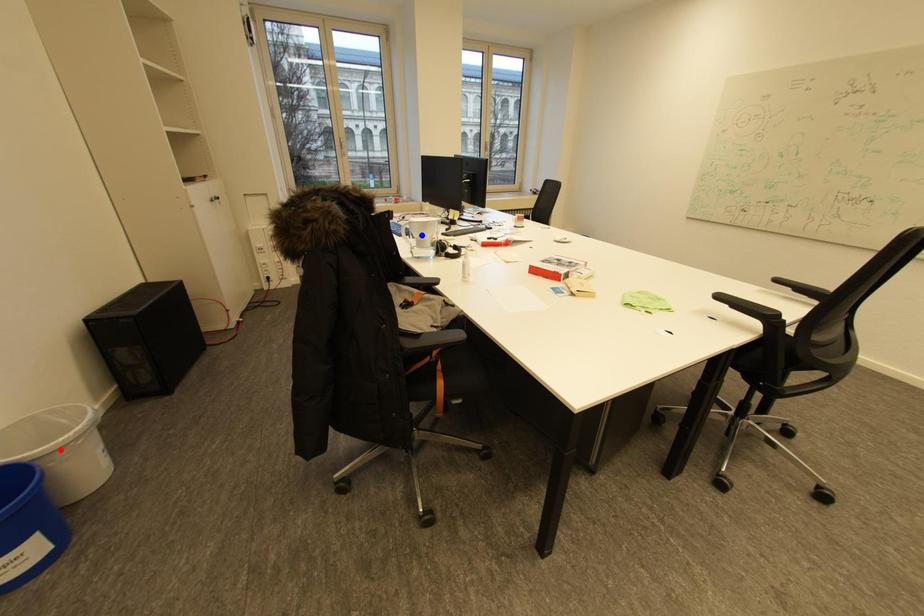
Question: Which of the two points in the image is closer to the camera?

Choices:
 (A) Blue point is closer.
 (B) Red point is closer.

Answer: (B)